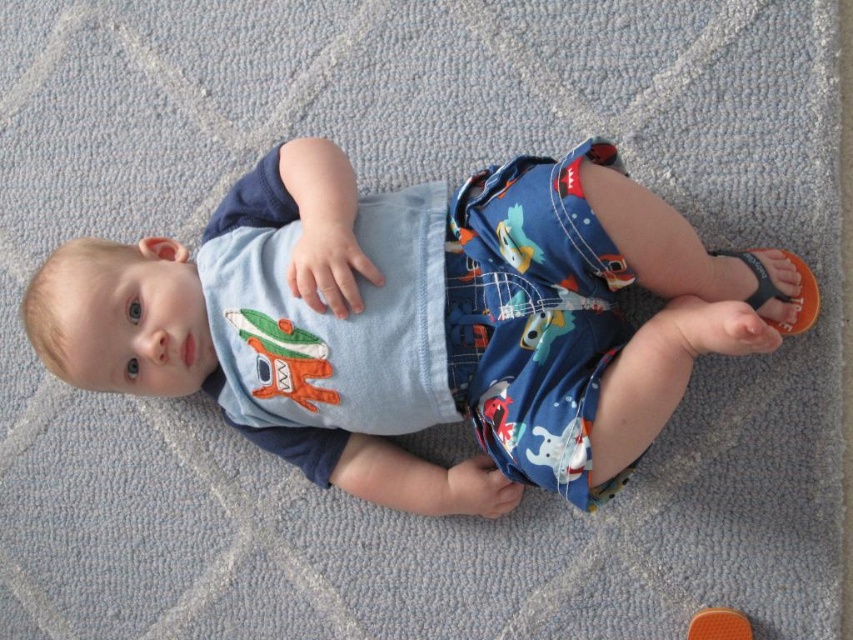
Where is the blue cotton baby at center located in the image?

The blue cotton baby at center is located at point (x=413, y=321).

You are a photographer taking a picture of the baby. You notice two points in the image labeled as point 1 and point 2. If point 1 is at coordinates point (386, 236) and point 2 is at point (785, 296), which point is closer to you?

Point 1 at coordinates point (386, 236) is closer to the viewer than point 2 at coordinates point (785, 296).